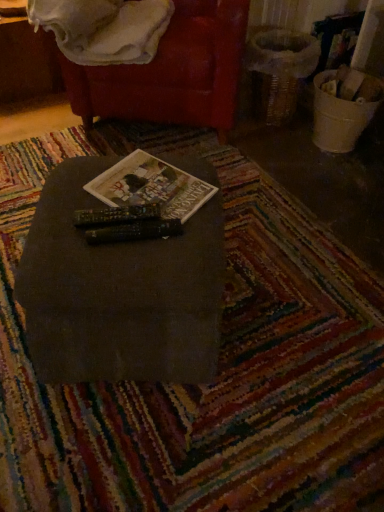
Locate an element on the screen. This screenshot has height=512, width=384. vacant area on top of matte black table at center (from a real-world perspective) is located at coordinates (131, 203).